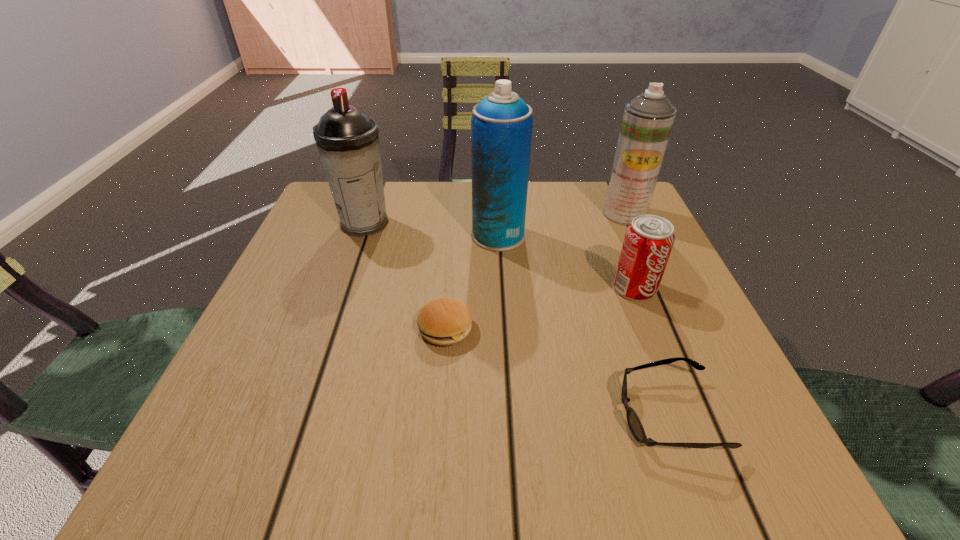
In order to click on vacant space that satisfies the following two spatial constraints: 1. on the back side of the rightmost aerosol can; 2. on the left side of the leftmost aerosol can in this screenshot , I will do `click(368, 213)`.

Identify the location of free spot that satisfies the following two spatial constraints: 1. on the front side of the third shortest object; 2. on the right side of the second aerosol can from left to right. Image resolution: width=960 pixels, height=540 pixels. (501, 288).